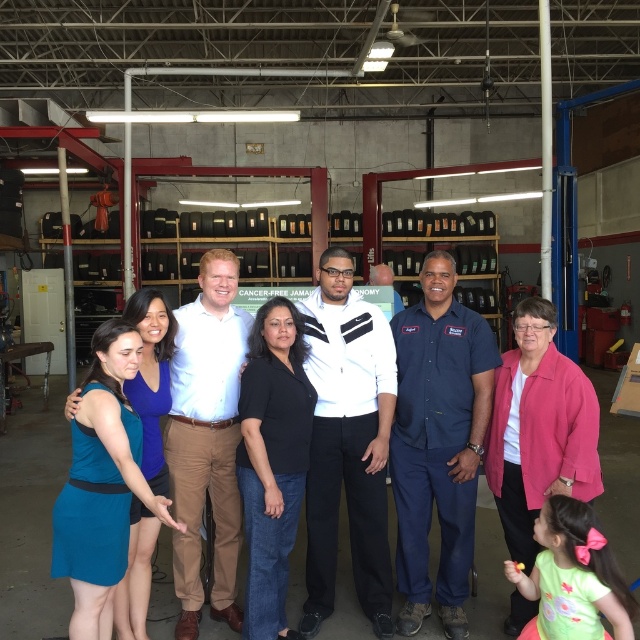
Can you confirm if dark blue uniform at center is thinner than white cotton shirt at center?

No.

Locate an element on the screen. The image size is (640, 640). dark blue uniform at center is located at coordinates (x=438, y=442).

Is dark blue uniform at center bigger than white matte jacket at center?

Correct, dark blue uniform at center is larger in size than white matte jacket at center.

Who is more forward, (451, 362) or (358, 596)?

Positioned in front is point (451, 362).

I want to click on dark blue uniform at center, so click(438, 442).

Does white matte jacket at center have a lesser height compared to white cotton shirt at center?

Indeed, white matte jacket at center has a lesser height compared to white cotton shirt at center.

I want to click on white matte jacket at center, so click(x=348, y=442).

Is point (328, 611) more distant than point (179, 417)?

That is True.

Identify the location of white matte jacket at center. (348, 442).